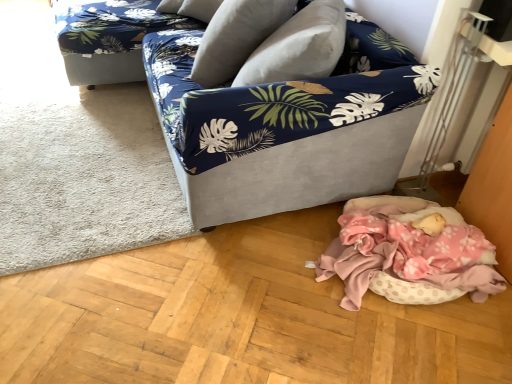
At what (x,y) coordinates should I click in order to perform the action: click on vacant space situated on the left part of pink polka dot fabric at lower right. Please return your answer as a coordinate pair (x, y). The image size is (512, 384). Looking at the image, I should click on (253, 284).